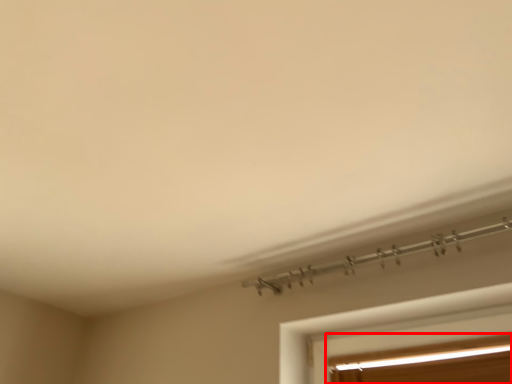
Question: From the image's perspective, where is window (annotated by the red box) located relative to window?

Choices:
 (A) below
 (B) above

Answer: (A)